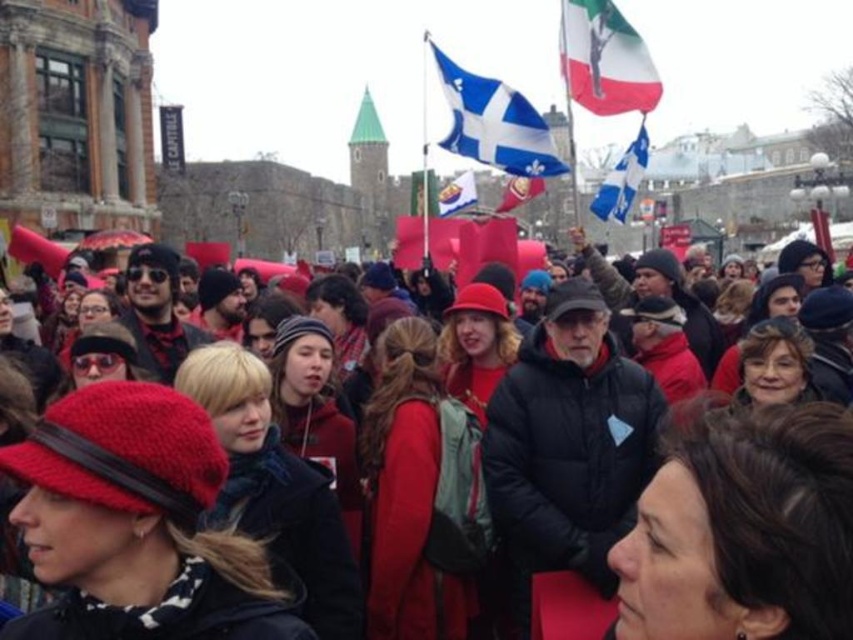
Question: Is red knit hat at center above white plastic flag at center?

Choices:
 (A) no
 (B) yes

Answer: (A)

Question: Does red knit hat at center lie in front of blue and white fabric flag at upper center?

Choices:
 (A) yes
 (B) no

Answer: (A)

Question: Based on their relative distances, which object is farther from the blue and white fabric flag at upper center?

Choices:
 (A) white fabric flag at upper right
 (B) matte red flag at center

Answer: (B)

Question: Is blue fabric flag at upper center smaller than white plastic flag at center?

Choices:
 (A) yes
 (B) no

Answer: (B)

Question: Which object is farther from the camera taking this photo?

Choices:
 (A) blue fabric flag at upper center
 (B) matte red flag at center
 (C) matte red flag at upper left
 (D) red knit hat at center

Answer: (B)

Question: Among these objects, which one is farthest from the camera?

Choices:
 (A) red knit hat at center
 (B) blue fabric flag at upper center

Answer: (B)